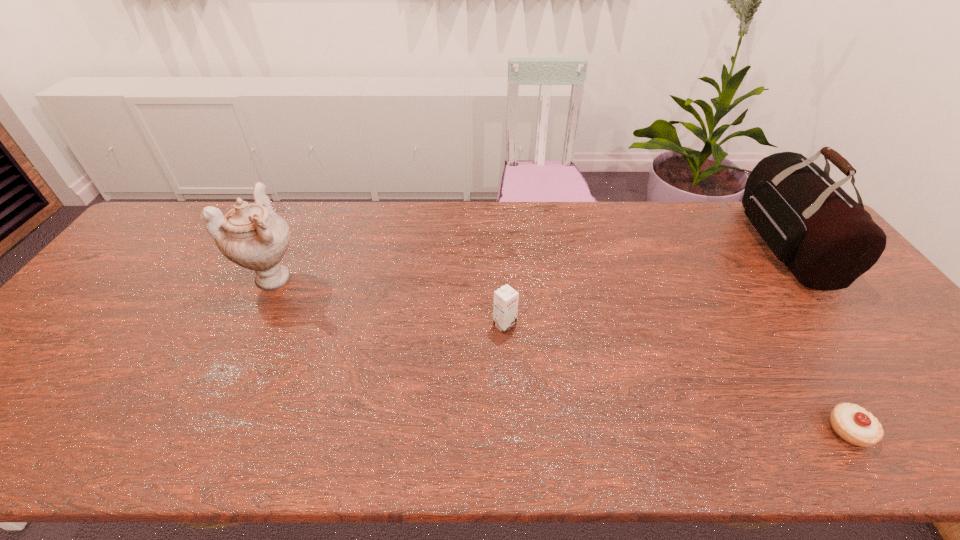
Where is `the rightmost object`? the rightmost object is located at coordinates (826, 239).

Find the location of a particular element. This screenshot has width=960, height=540. urn is located at coordinates (253, 236).

In order to click on the third tallest object in this screenshot , I will do `click(506, 298)`.

I want to click on the third farthest object, so click(x=506, y=298).

Where is `the nearest object`? The height and width of the screenshot is (540, 960). the nearest object is located at coordinates (852, 423).

In order to click on pastry in this screenshot , I will do `click(852, 423)`.

This screenshot has width=960, height=540. I want to click on free space located on the front pocket of the rightmost object, so click(712, 244).

The image size is (960, 540). I want to click on vacant space positioned on the front pocket of the rightmost object, so pos(639,244).

Find the location of a particular element. vacant space located 0.060m on the front pocket of the rightmost object is located at coordinates (732, 244).

Locate an element on the screen. Image resolution: width=960 pixels, height=540 pixels. free space located 0.330m on the front of the urn is located at coordinates (209, 412).